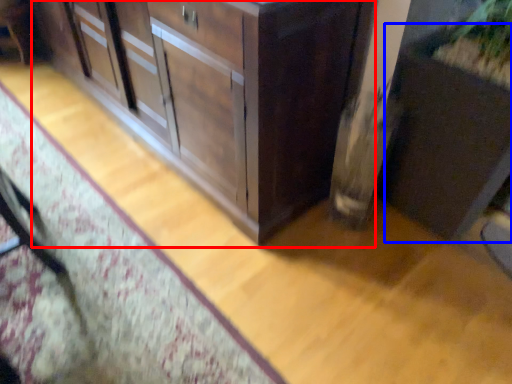
Question: Which point is closer to the camera, cabinetry (highlighted by a red box) or cabinetry (highlighted by a blue box)?

Choices:
 (A) cabinetry
 (B) cabinetry

Answer: (B)